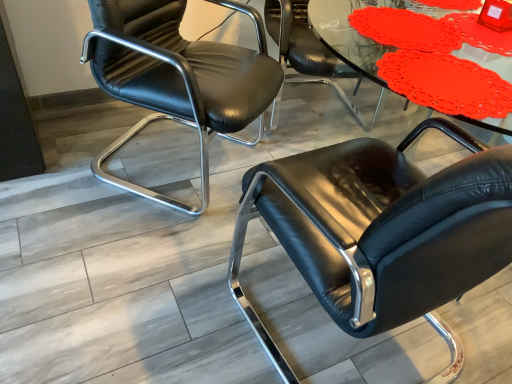
Where is `free space underneath black leather chair at left, placed as the 1th chair when sorted from left to right (from a real-world perspective)`? free space underneath black leather chair at left, placed as the 1th chair when sorted from left to right (from a real-world perspective) is located at coordinates (180, 165).